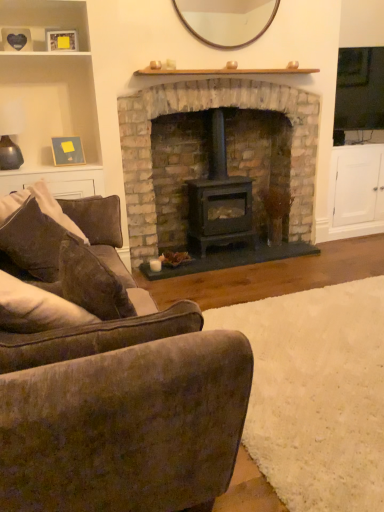
Question: In the image, is velvety brown armchair at lower left on the left side or the right side of black matte wood burning stove at center?

Choices:
 (A) right
 (B) left

Answer: (A)

Question: Considering the positions of velvety brown armchair at lower left and black matte wood burning stove at center in the image, is velvety brown armchair at lower left bigger or smaller than black matte wood burning stove at center?

Choices:
 (A) big
 (B) small

Answer: (B)

Question: Which of these objects is positioned farthest from the wooden picture frame at upper left, arranged as the 2th picture frame when viewed from the back?

Choices:
 (A) velvety brown armchair at lower left
 (B) wooden shelf at upper left
 (C) black matte wood burning stove at center
 (D) wooden mirror at upper center
 (E) stone fireplace at center

Answer: (A)

Question: Which object is positioned closest to the brown fabric pillow at left?

Choices:
 (A) wooden shelf at upper left
 (B) wooden mirror at upper center
 (C) velvety brown armchair at lower left
 (D) black matte wood burning stove at center
 (E) wooden picture frame at upper left, the first picture frame in the bottom-to-top sequence

Answer: (C)